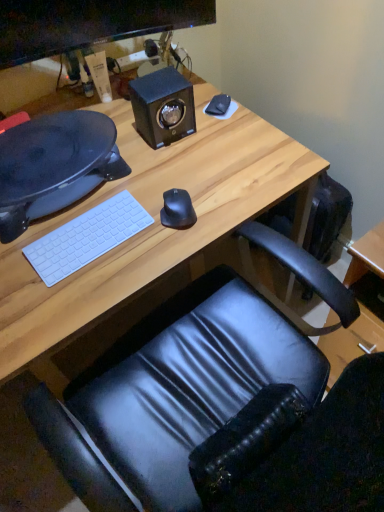
You are a GUI agent. You are given a task and a screenshot of the screen. Output one action in this format:
    pyautogui.click(x=<x>, y=<y>)
    Task: Click on the vacant area that is in front of black glossy speaker at left
    The image size is (384, 512).
    Given the screenshot: What is the action you would take?
    pyautogui.click(x=72, y=270)